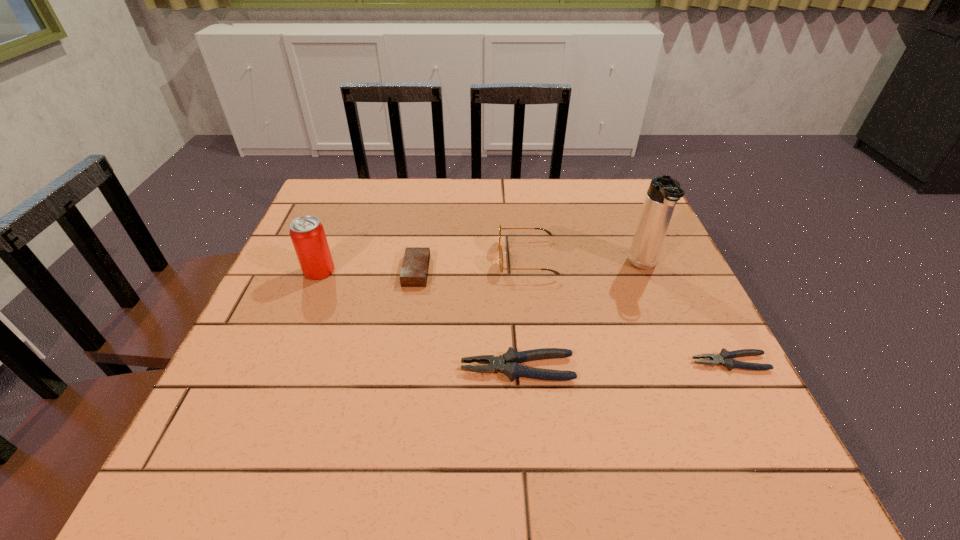
Where is `object at the near edge`? This screenshot has width=960, height=540. object at the near edge is located at coordinates (508, 363).

Where is `object positioned at the left edge`? This screenshot has width=960, height=540. object positioned at the left edge is located at coordinates (307, 234).

This screenshot has height=540, width=960. Identify the location of pliers that is at the right edge. (725, 358).

Find the location of `thermos bottle positioned at the right edge`. thermos bottle positioned at the right edge is located at coordinates (664, 192).

Locate an element on the screen. vacant space at the far edge is located at coordinates (572, 218).

At what (x,y) coordinates should I click in order to perform the action: click on free space at the left edge. Please return your answer as a coordinate pair (x, y). The image size is (960, 540). Looking at the image, I should click on (262, 354).

The height and width of the screenshot is (540, 960). In the image, there is a desktop. What are the coordinates of `vacant region at the right edge` in the screenshot? It's located at [x=622, y=283].

You are a GUI agent. You are given a task and a screenshot of the screen. Output one action in this format:
    pyautogui.click(x=<x>, y=<y>)
    Task: Click on the free space at the far left corner
    This screenshot has width=960, height=540.
    Given the screenshot: What is the action you would take?
    pyautogui.click(x=324, y=194)

The height and width of the screenshot is (540, 960). In order to click on free spot at the near left corner of the desktop in this screenshot , I will do `click(300, 386)`.

Identify the location of vacant region at the far right corner. (595, 193).